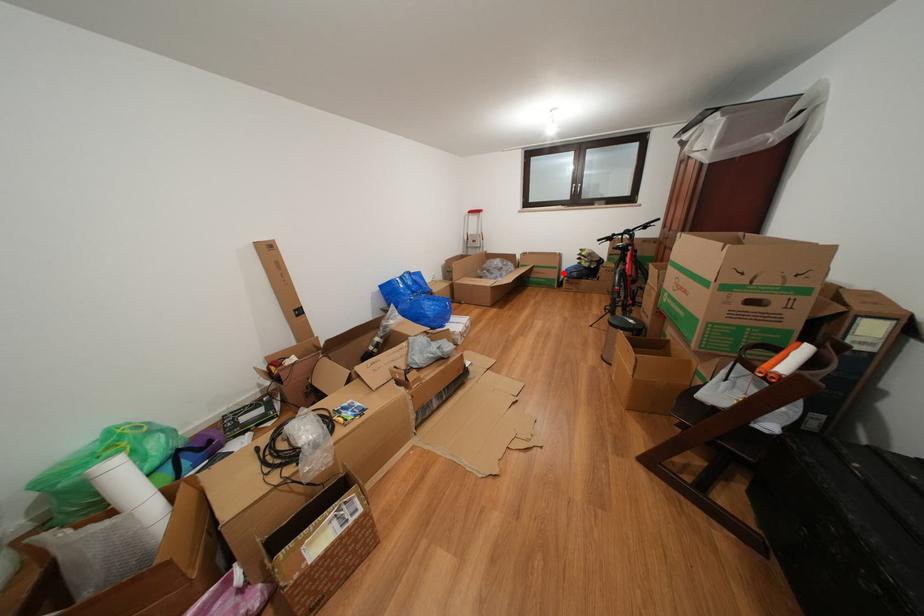
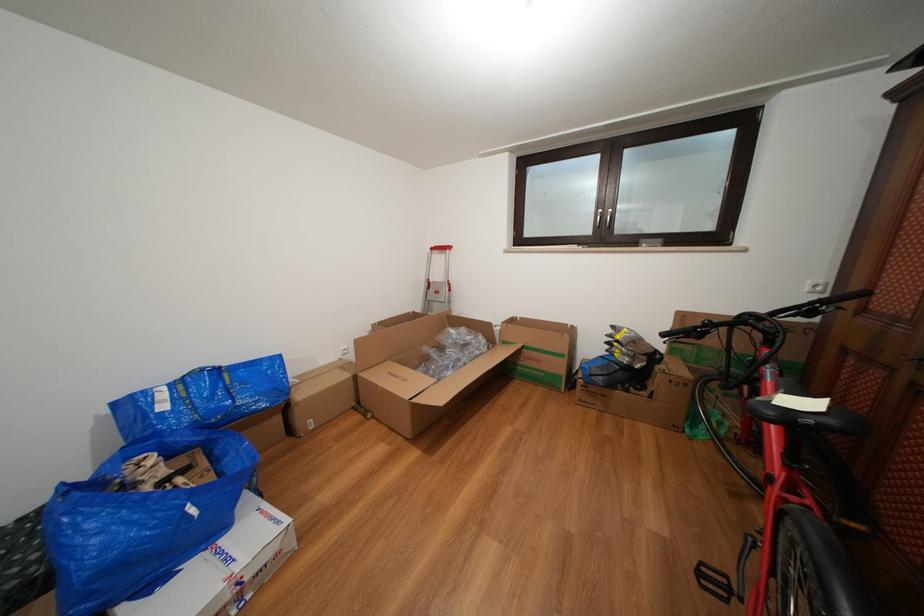
Find the pixel in the second image that matches the highlighted location in the first image.

(570, 361)